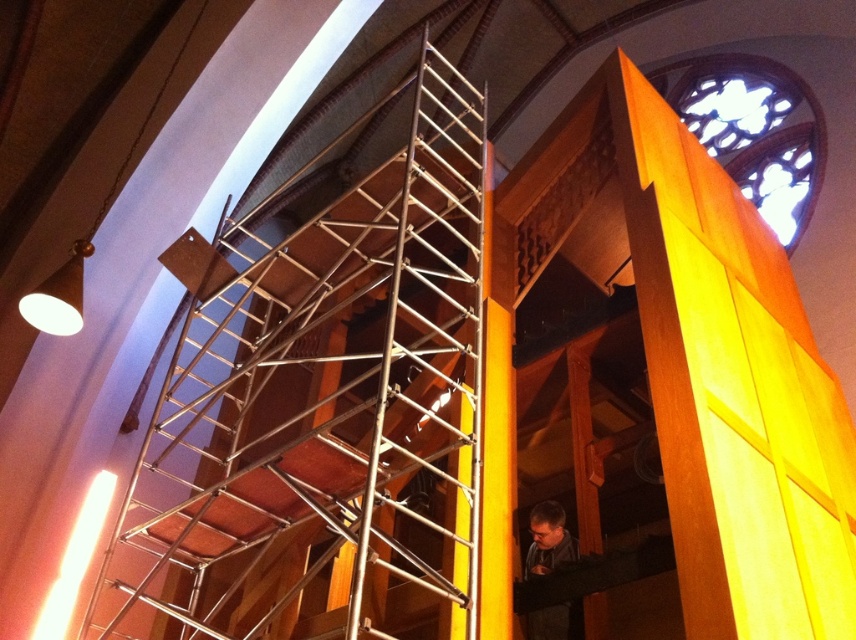
You are an event planner setting up a stage in the church. You have a metallic scaffolding at center and a dark gray fabric at lower right. Which object is wider?

The metallic scaffolding at center is wider than the dark gray fabric at lower right.

You are a maintenance worker who needs to move a 3.5 feet long ladder from the dark gray fabric at lower right to the metallic scaffolding at center. Can you safely carry the ladder horizontally without tilting it? Please explain your reasoning.

The distance between the metallic scaffolding at center and the dark gray fabric at lower right is 39.14 inches. Since the ladder is 3.5 feet long, which converts to 42 inches, the ladder is longer than the available space. Therefore, you cannot safely carry the ladder horizontally without tilting it.

You are an event planner setting up a stage in this church. You have a metallic scaffolding at center and a dark gray fabric at lower right. Which object is located above the other?

The metallic scaffolding at center is positioned over dark gray fabric at lower right.